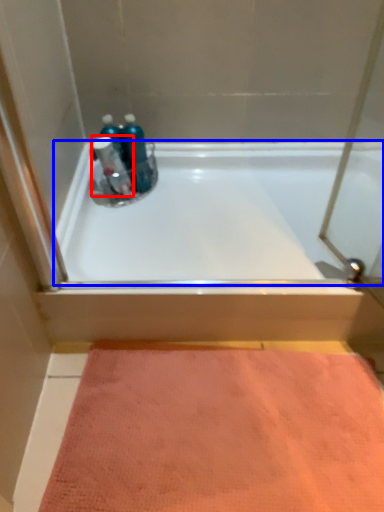
Question: Which point is closer to the camera, cleaning product (highlighted by a red box) or bathtub (highlighted by a blue box)?

Choices:
 (A) cleaning product
 (B) bathtub

Answer: (B)